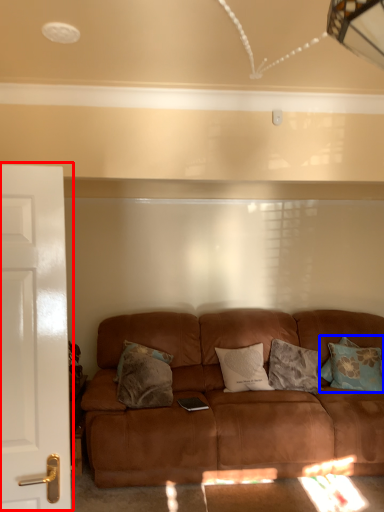
Question: Which point is closer to the camera, door (highlighted by a red box) or pillow (highlighted by a blue box)?

Choices:
 (A) door
 (B) pillow

Answer: (A)